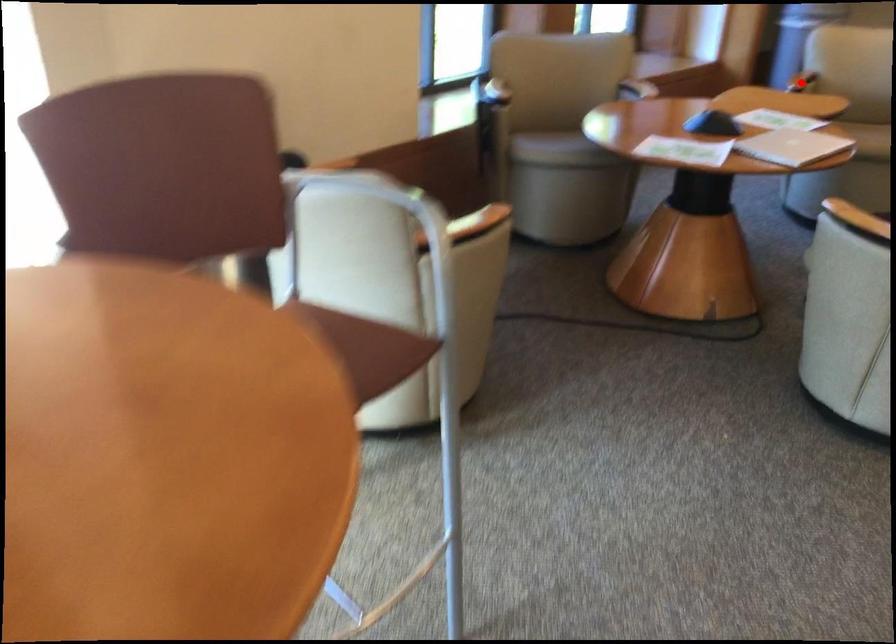
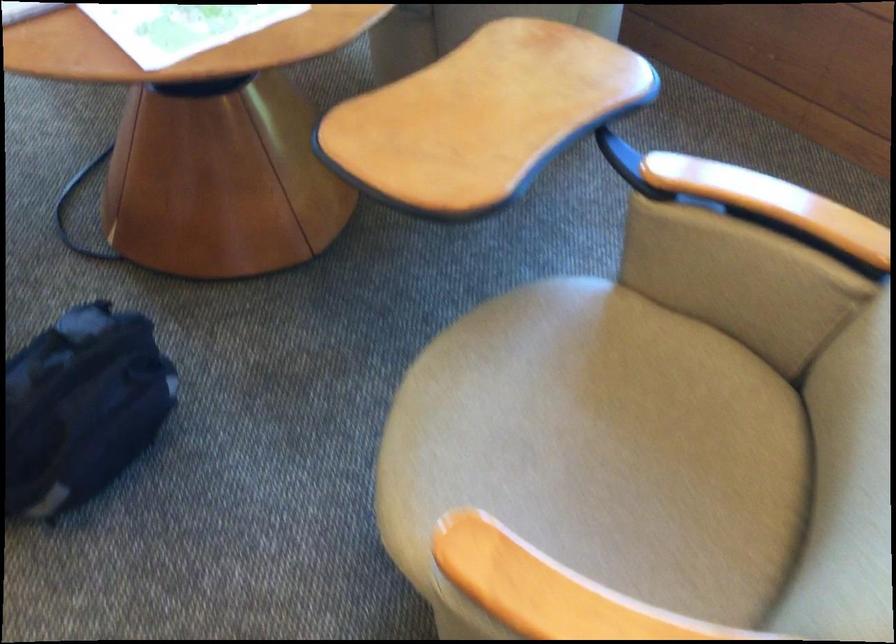
Question: I am providing you with two images of the same scene from different viewpoints. A red point is marked on the first image. Is the red point's position out of view in image 2?

Choices:
 (A) Yes
 (B) No

Answer: (A)